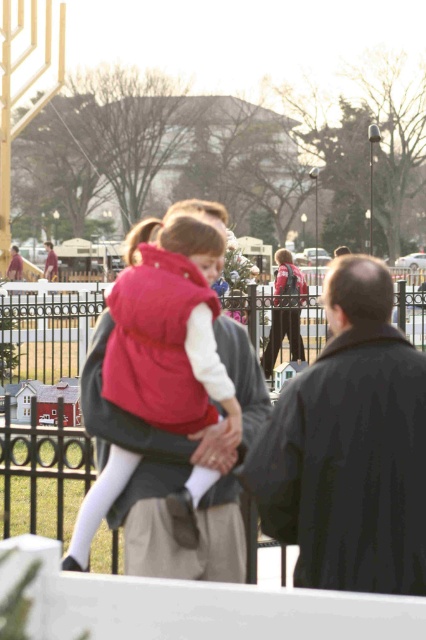
Question: Is black iron fence at center wider than matte red vest at center?

Choices:
 (A) no
 (B) yes

Answer: (B)

Question: Which point is closer to the camera?

Choices:
 (A) matte black jacket at center
 (B) dark brown leather jacket at center
 (C) black iron fence at center

Answer: (B)

Question: Which of the following is the farthest from the observer?

Choices:
 (A) black iron fence at center
 (B) matte black jacket at center
 (C) dark brown leather jacket at center

Answer: (B)

Question: Considering the real-world distances, which object is closest to the dark brown leather jacket at center?

Choices:
 (A) matte red vest at center
 (B) black iron fence at center
 (C) matte black jacket at center

Answer: (A)

Question: Where is matte red vest at center located in relation to matte black jacket at center in the image?

Choices:
 (A) right
 (B) left

Answer: (B)

Question: Can you confirm if dark brown leather jacket at center is positioned to the left of matte black jacket at center?

Choices:
 (A) no
 (B) yes

Answer: (B)